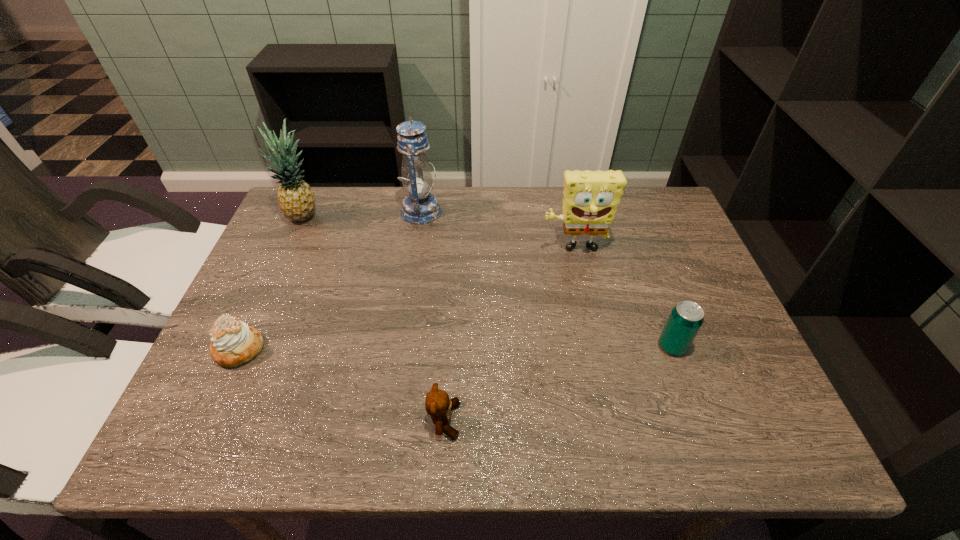
The image size is (960, 540). In order to click on object that is at the right edge in this screenshot , I will do tap(686, 318).

Where is `object situated at the far left corner`? This screenshot has height=540, width=960. object situated at the far left corner is located at coordinates (296, 199).

Where is `free space at the far edge`? Image resolution: width=960 pixels, height=540 pixels. free space at the far edge is located at coordinates coord(560,235).

Locate an element on the screen. free space at the near edge is located at coordinates (378, 424).

This screenshot has width=960, height=540. In the image, there is a desktop. Find the location of `blank space at the left edge`. blank space at the left edge is located at coordinates (281, 300).

Identify the location of blank space at the right edge of the desktop. (713, 392).

The height and width of the screenshot is (540, 960). Find the location of `vacant space at the far left corner of the desktop`. vacant space at the far left corner of the desktop is located at coordinates (298, 235).

Image resolution: width=960 pixels, height=540 pixels. What are the coordinates of `vacant space at the far right corner of the desktop` in the screenshot? It's located at (629, 198).

Find the location of `vacant point located between the teddy bear and the pastry`. vacant point located between the teddy bear and the pastry is located at coordinates (342, 385).

This screenshot has height=540, width=960. I want to click on free point between the third shortest object and the fourth object from right to left, so click(x=546, y=279).